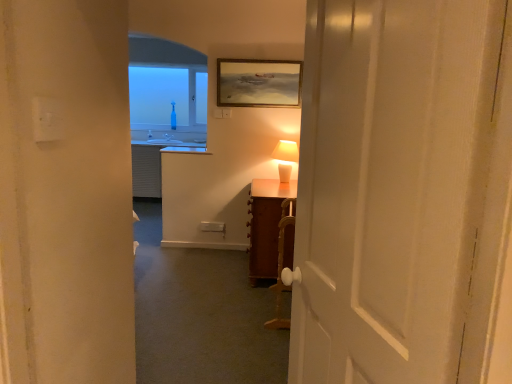
Question: Is white plastic electric outlet at upper center situated inside transparent glass bottle at upper center or outside?

Choices:
 (A) outside
 (B) inside

Answer: (A)

Question: From their relative heights in the image, would you say white plastic electric outlet at upper center is taller or shorter than transparent glass bottle at upper center?

Choices:
 (A) tall
 (B) short

Answer: (B)

Question: Which object is the farthest from the white ceramic table lamp at center?

Choices:
 (A) transparent glass bottle at upper center
 (B) white wooden door at center
 (C) wooden cabinet at center
 (D) white plastic electric outlet at upper center
 (E) gold-framed painting at upper center

Answer: (A)

Question: Which of these objects is positioned closest to the white wooden door at center?

Choices:
 (A) white ceramic table lamp at center
 (B) white plastic electric outlet at upper center
 (C) wooden cabinet at right
 (D) gold-framed painting at upper center
 (E) wooden cabinet at center

Answer: (E)